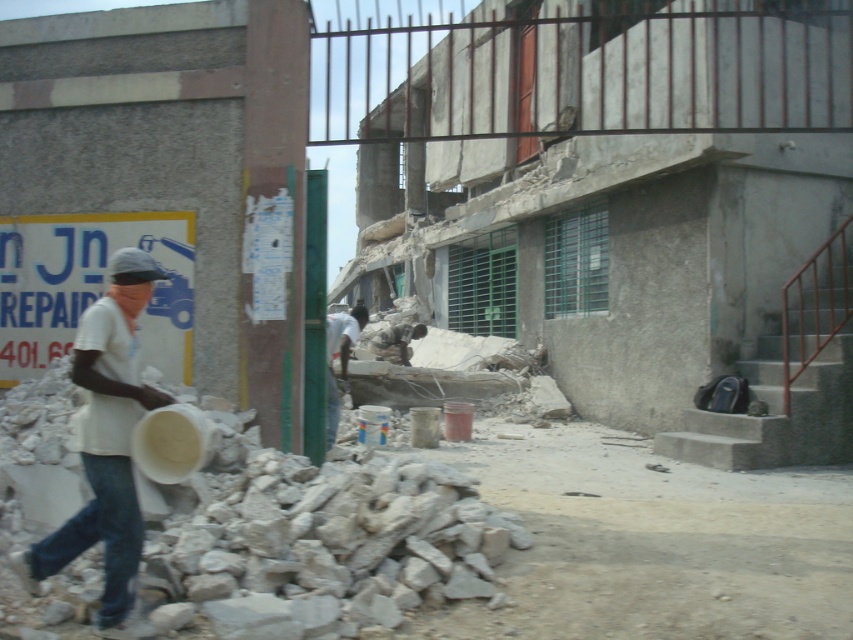
Who is higher up, white matte bucket at left or white fabric shirt at center?

white matte bucket at left is higher up.

In the scene shown: Does white matte bucket at left appear over white fabric shirt at center?

Indeed, white matte bucket at left is positioned over white fabric shirt at center.

What do you see at coordinates (106, 442) in the screenshot? I see `white matte bucket at left` at bounding box center [106, 442].

In order to click on white matte bucket at left in this screenshot , I will do `click(106, 442)`.

Can you confirm if jeans at left is shorter than white fabric shirt at center?

No, jeans at left is not shorter than white fabric shirt at center.

Which is in front, point (126, 596) or point (345, 340)?

Point (126, 596) is in front.

Locate an element on the screen. The width and height of the screenshot is (853, 640). jeans at left is located at coordinates (100, 532).

Does white matte bucket at left appear on the right side of jeans at left?

In fact, white matte bucket at left is to the left of jeans at left.

Does white matte bucket at left appear under jeans at left?

No, white matte bucket at left is not below jeans at left.

At what (x,y) coordinates should I click in order to perform the action: click on white matte bucket at left. Please return your answer as a coordinate pair (x, y). The width and height of the screenshot is (853, 640). Looking at the image, I should click on (106, 442).